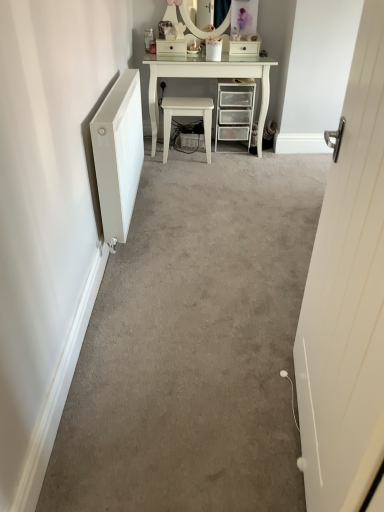
Image resolution: width=384 pixels, height=512 pixels. Identify the location of vacant region in front of white glossy stool at center. (192, 170).